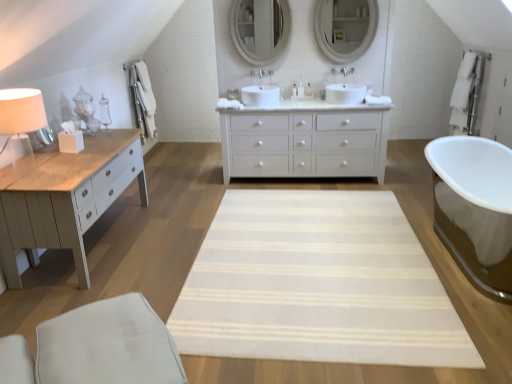
Question: Is white painted wood chest of drawers at center wider or thinner than white fabric swivel chair at lower left?

Choices:
 (A) wide
 (B) thin

Answer: (B)

Question: From a real-world perspective, relative to white fabric swivel chair at lower left, is white painted wood chest of drawers at center vertically above or below?

Choices:
 (A) above
 (B) below

Answer: (A)

Question: Considering the real-world distances, which object is farthest from the translucent glass bottle at center?

Choices:
 (A) white ceramic faucet at center, which is the first faucet from right to left
 (B) white ceramic faucet at center, the 1th faucet viewed from the left
 (C) white painted wood chest of drawers at center
 (D) beige striped rug at center
 (E) matte white lampshade at left

Answer: (E)

Question: Which is farther from the beige striped rug at center?

Choices:
 (A) white ceramic faucet at center, the second faucet when ordered from left to right
 (B) white fabric swivel chair at lower left
 (C) matte white lampshade at left
 (D) translucent glass bottle at center
 (E) white painted wood chest of drawers at center

Answer: (A)